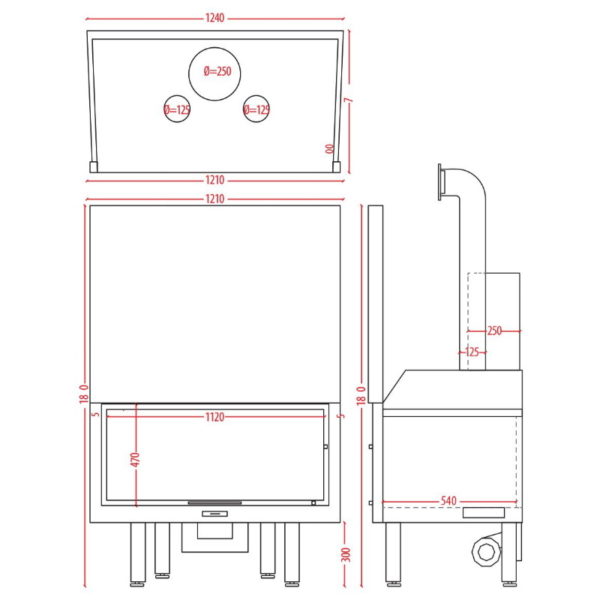
In order to click on front of a bottom door in this screenshot , I will do `click(304, 472)`.